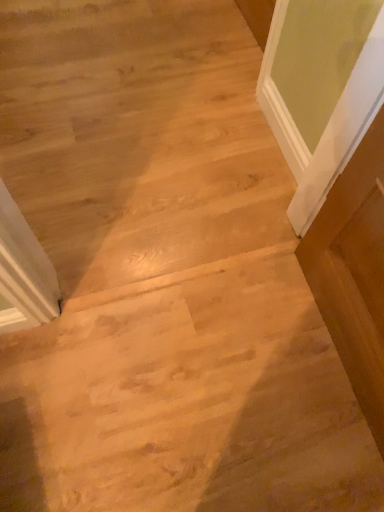
Identify the location of vacant space behind wooden door at right. The height and width of the screenshot is (512, 384). (253, 227).